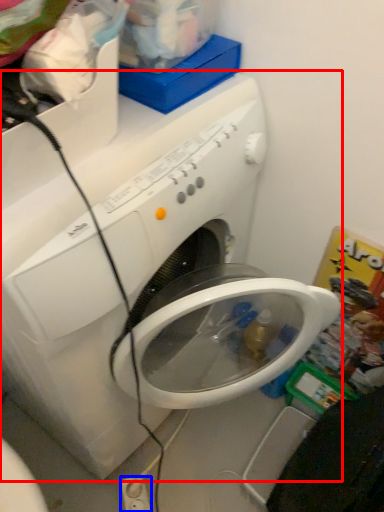
Question: Which of the following is the closest to the observer, washing machine (highlighted by a red box) or electric outlet (highlighted by a blue box)?

Choices:
 (A) washing machine
 (B) electric outlet

Answer: (A)